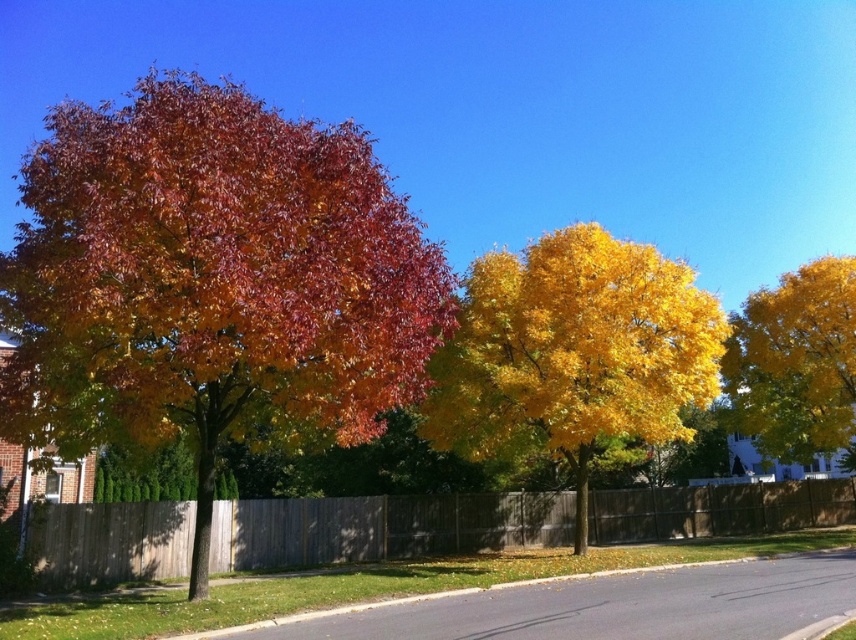
Question: Can you confirm if multicolored foliage at left is bigger than golden yellow leaves at center?

Choices:
 (A) no
 (B) yes

Answer: (B)

Question: Does wooden fence at center appear on the left side of yellow glossy tree at right?

Choices:
 (A) yes
 (B) no

Answer: (A)

Question: Is golden yellow leaves at center in front of yellow glossy tree at right?

Choices:
 (A) no
 (B) yes

Answer: (B)

Question: Which of the following is the closest to the observer?

Choices:
 (A) wooden fence at center
 (B) golden yellow leaves at center
 (C) multicolored foliage at left

Answer: (C)

Question: Which object is positioned farthest from the multicolored foliage at left?

Choices:
 (A) golden yellow leaves at center
 (B) yellow glossy tree at right
 (C) wooden fence at center

Answer: (B)

Question: Estimate the real-world distances between objects in this image. Which object is farther from the golden yellow leaves at center?

Choices:
 (A) yellow glossy tree at right
 (B) multicolored foliage at left

Answer: (A)